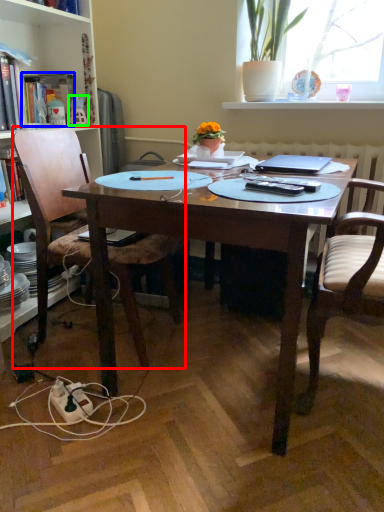
Question: Which object is positioned farthest from chair (highlighted by a red box)? Select from book (highlighted by a blue box) and toy (highlighted by a green box).

Choices:
 (A) book
 (B) toy

Answer: (B)